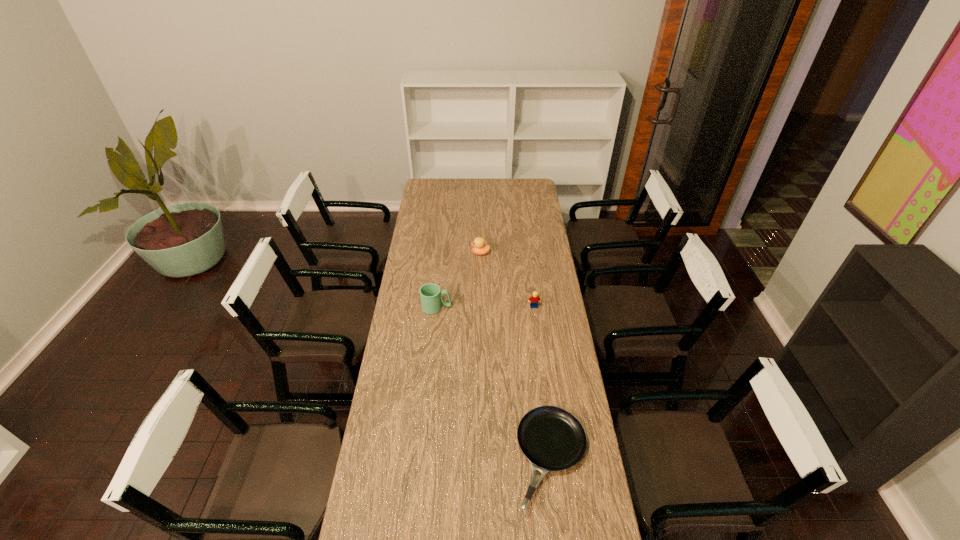
Find the location of a particular element. Image resolution: width=960 pixels, height=540 pixels. blank area located 0.290m on the face of the duckling is located at coordinates (417, 253).

Where is `free region located on the front-facing side of the Lego`? The height and width of the screenshot is (540, 960). free region located on the front-facing side of the Lego is located at coordinates (536, 323).

Where is `free space located on the left of the shortest object`? This screenshot has height=540, width=960. free space located on the left of the shortest object is located at coordinates (467, 458).

Identify the location of object at the left edge. This screenshot has width=960, height=540. (431, 297).

Identify the location of Lego that is at the right edge. The image size is (960, 540). (535, 299).

The width and height of the screenshot is (960, 540). I want to click on pan at the right edge, so click(x=552, y=439).

Identify the location of free space at the far edge of the desktop. This screenshot has width=960, height=540. (449, 184).

In order to click on free region at the left edge in this screenshot , I will do `click(383, 489)`.

In the image, there is a desktop. Identify the location of vacant space at the right edge. The width and height of the screenshot is (960, 540). (527, 293).

Locate an element on the screen. free region at the far right corner of the desktop is located at coordinates (523, 183).